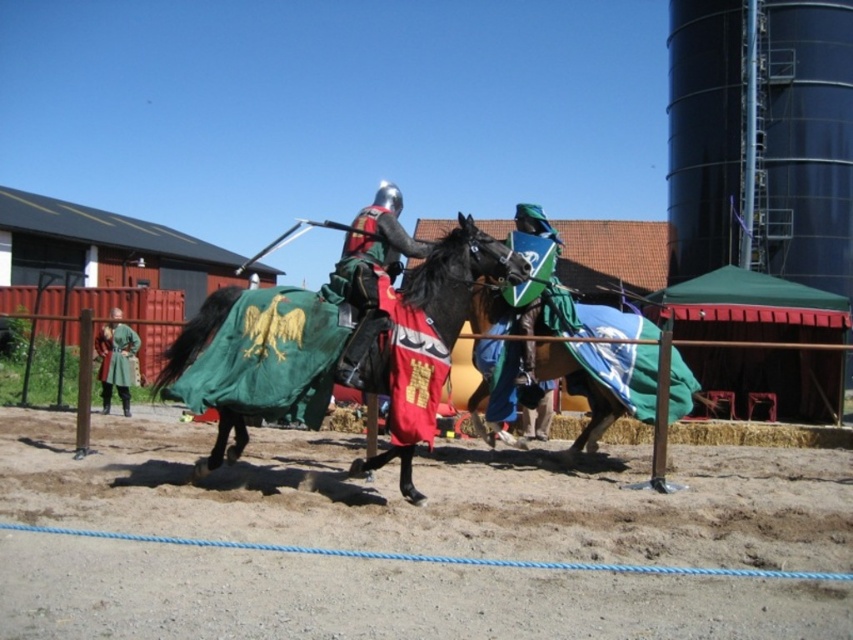
You are a photographer standing at the camera position in the scene. You want to take a closeup shot of the green velvet horse at center. Given that your camera has a maximum focus range of 20 feet, will you be able to focus on the horse?

The green velvet horse at center is 19.68 feet away from the camera, which is within the maximum focus range of 20 feet. Therefore, the photographer can focus on the horse.

You are a knight preparing to joust and need to ensure your lance can reach the ground for a proper stance. Given the brown sandy dirt at center and the green velvet horse at center, which object is lower to the ground?

The brown sandy dirt at center is shorter than the green velvet horse at center, so the brown sandy dirt at center is lower to the ground.

You are a medieval knight participating in a jousting tournament. Your horse is currently standing on the brown sandy dirt at center. The nearest hay bale is 3.69 meters away from you. If your horse can jump over obstacles up to 3 meters, can you safely jump over the hay bale without dismounting?

The nearest hay bale is 3.69 meters away from the brown sandy dirt at center. Since the horse can only jump up to 3 meters, it cannot safely jump over the hay bale without dismounting.